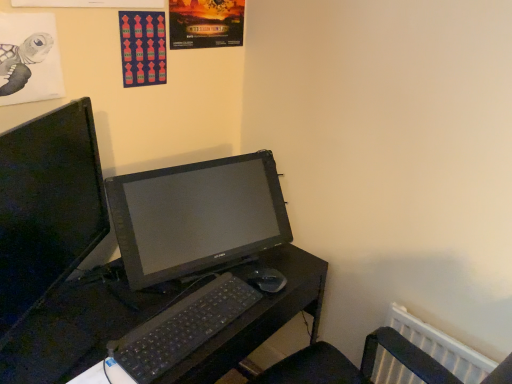
Question: Should I look upward or downward to see black plastic mouse at lower center?

Choices:
 (A) up
 (B) down

Answer: (B)

Question: Is matte paper turtle at upper left, which appears as the 1th poster page when viewed from the left, surrounding red fabric poster at upper center, acting as the second poster page starting from the left?

Choices:
 (A) yes
 (B) no

Answer: (B)

Question: Is matte paper turtle at upper left, which appears as the 1th poster page when viewed from the left, to the left of red fabric poster at upper center, acting as the second poster page starting from the left, from the viewer's perspective?

Choices:
 (A) no
 (B) yes

Answer: (B)

Question: Is the depth of matte paper turtle at upper left, which appears as the 1th poster page when viewed from the left, less than that of red fabric poster at upper center, placed as the second poster page when sorted from right to left?

Choices:
 (A) no
 (B) yes

Answer: (B)

Question: Is matte paper turtle at upper left, which appears as the 1th poster page when viewed from the left, smaller than red fabric poster at upper center, acting as the second poster page starting from the left?

Choices:
 (A) no
 (B) yes

Answer: (A)

Question: Can you confirm if matte paper turtle at upper left, which appears as the 1th poster page when viewed from the left, is wider than red fabric poster at upper center, placed as the second poster page when sorted from right to left?

Choices:
 (A) no
 (B) yes

Answer: (A)

Question: Does matte paper turtle at upper left, which is counted as the 3th poster page, starting from the right, have a lesser width compared to red fabric poster at upper center, placed as the second poster page when sorted from right to left?

Choices:
 (A) no
 (B) yes

Answer: (B)

Question: Can you confirm if red fabric poster at upper center, placed as the second poster page when sorted from right to left, is taller than black plastic desk at center?

Choices:
 (A) no
 (B) yes

Answer: (A)

Question: Is red fabric poster at upper center, acting as the second poster page starting from the left, positioned beyond the bounds of black plastic desk at center?

Choices:
 (A) no
 (B) yes

Answer: (B)

Question: From the image's perspective, would you say red fabric poster at upper center, acting as the second poster page starting from the left, is positioned over black plastic desk at center?

Choices:
 (A) yes
 (B) no

Answer: (A)

Question: Are red fabric poster at upper center, placed as the second poster page when sorted from right to left, and black plastic desk at center making contact?

Choices:
 (A) yes
 (B) no

Answer: (B)

Question: Is red fabric poster at upper center, acting as the second poster page starting from the left, shorter than black plastic desk at center?

Choices:
 (A) yes
 (B) no

Answer: (A)

Question: Is red fabric poster at upper center, placed as the second poster page when sorted from right to left, wider than black plastic desk at center?

Choices:
 (A) no
 (B) yes

Answer: (A)

Question: Would you say black plastic desk at center is a long distance from red fabric poster at upper center, acting as the second poster page starting from the left?

Choices:
 (A) no
 (B) yes

Answer: (A)